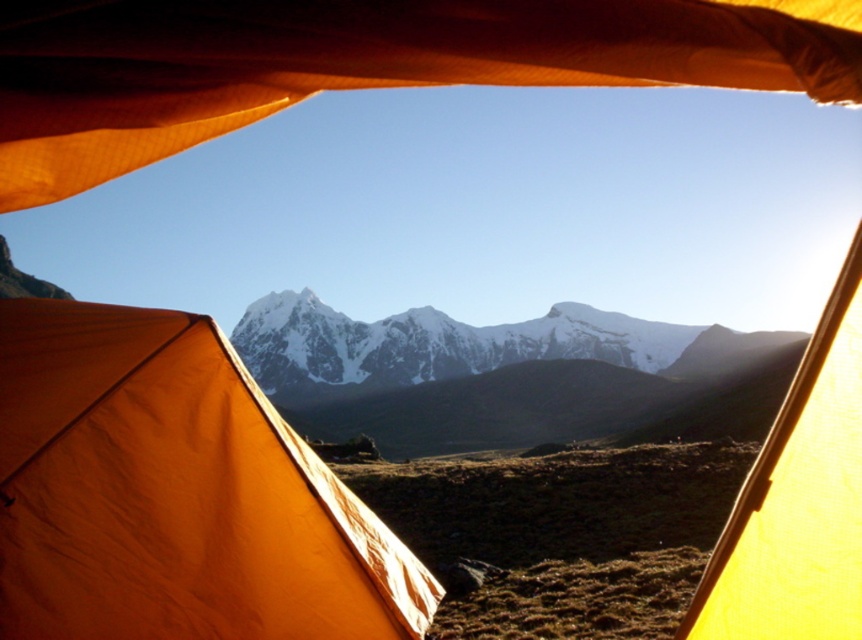
Question: In this image, where is orange fabric tent at center located relative to orange fabric canopy at upper center?

Choices:
 (A) below
 (B) above

Answer: (A)

Question: Which point appears farthest from the camera in this image?

Choices:
 (A) (150, 54)
 (B) (523, 396)
 (C) (240, 532)

Answer: (B)

Question: Can you confirm if orange fabric tent at center is positioned to the right of snowy granite mountain range at center?

Choices:
 (A) yes
 (B) no

Answer: (B)

Question: Is orange fabric tent at center to the right of snowy granite mountain range at center from the viewer's perspective?

Choices:
 (A) no
 (B) yes

Answer: (A)

Question: Which object is farther from the camera taking this photo?

Choices:
 (A) orange fabric tent at center
 (B) snowy granite mountain range at center
 (C) orange fabric canopy at upper center

Answer: (B)

Question: Which point appears farthest from the camera in this image?

Choices:
 (A) (386, 400)
 (B) (130, 552)
 (C) (78, 54)

Answer: (A)